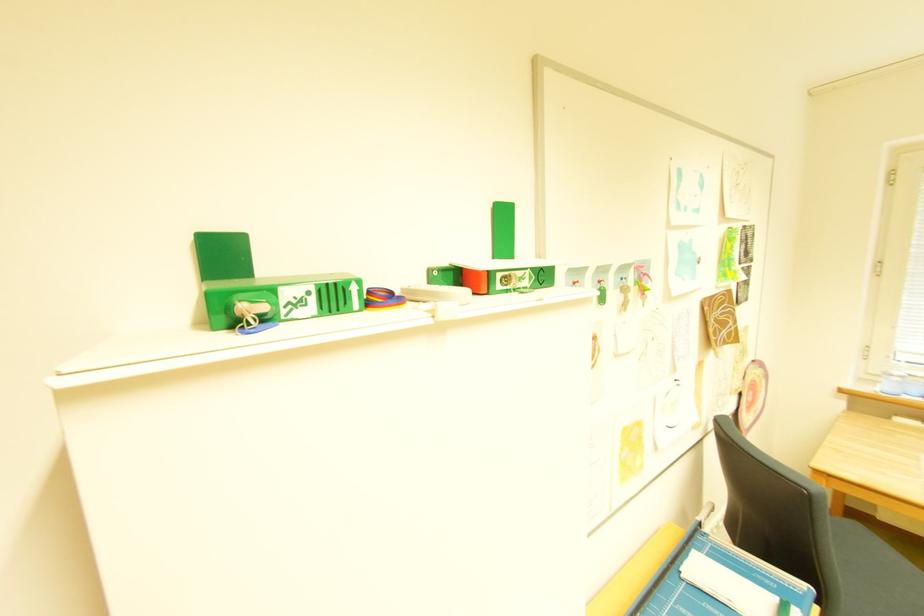
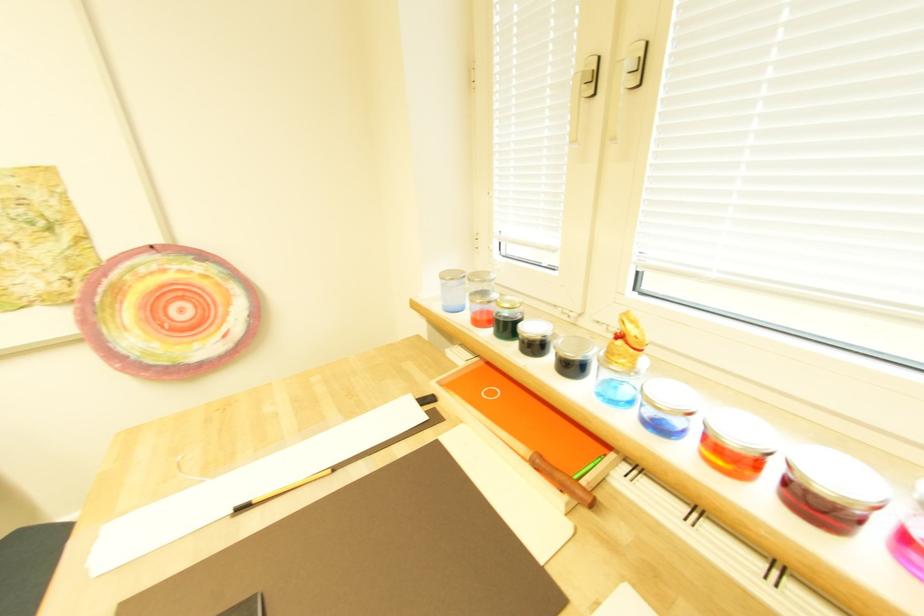
Question: What movement of the cameraman would produce the second image?

Choices:
 (A) Left
 (B) Right
 (C) Forward
 (D) Backward

Answer: (B)